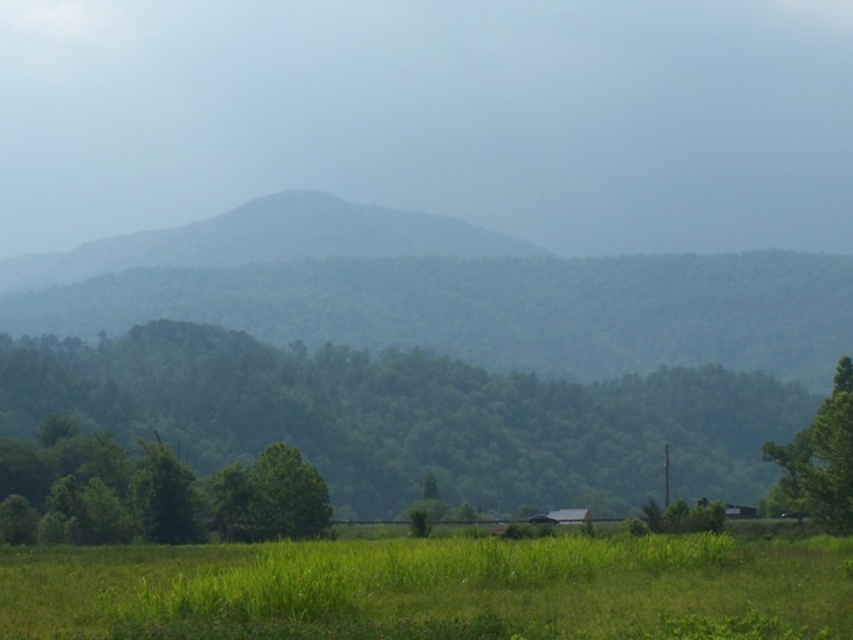
The image size is (853, 640). What do you see at coordinates (434, 589) in the screenshot?
I see `green grass at lower center` at bounding box center [434, 589].

Does point (62, 618) come farther from viewer compared to point (169, 499)?

No, it is in front of (169, 499).

Between point (564, 637) and point (80, 525), which one is positioned in front?

Point (564, 637) is more forward.

What are the coordinates of `green grass at lower center` in the screenshot? It's located at (434, 589).

Is green leafy tree at center bigger than green leafy tree at right?

Yes, green leafy tree at center is bigger than green leafy tree at right.

Does green leafy tree at center have a greater width compared to green leafy tree at right?

Correct, the width of green leafy tree at center exceeds that of green leafy tree at right.

Between point (741, 372) and point (814, 461), which one is positioned in front?

Point (814, 461)

The height and width of the screenshot is (640, 853). Find the location of `green leafy tree at center`. green leafy tree at center is located at coordinates (410, 417).

Locate an element on the screen. Image resolution: width=853 pixels, height=640 pixels. green grass at lower center is located at coordinates (434, 589).

Does point (802, 593) lie behind point (846, 442)?

No, it is in front of (846, 442).

Identify the location of green grass at lower center. (434, 589).